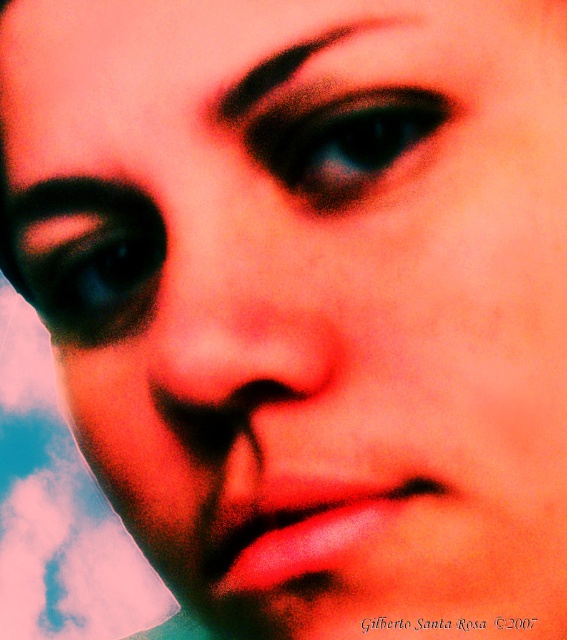
Based on the photo, who is taller, matte black eye at upper left or black matte eyebrow at upper center?

matte black eye at upper left

Between matte black eye at upper left and black matte eyebrow at upper center, which one is positioned higher?

black matte eyebrow at upper center

Is point (122, 280) closer to viewer compared to point (243, 100)?

No, (122, 280) is further to viewer.

At what (x,y) coordinates should I click in order to perform the action: click on matte black eye at upper left. Please return your answer as a coordinate pair (x, y). This screenshot has height=640, width=567. Looking at the image, I should click on (94, 268).

Which is behind, point (391, 120) or point (236, 106)?

The point (236, 106) is more distant.

How distant is black glittery eye at center from black matte eyebrow at upper center?

They are 0.42 inches apart.

Locate an element on the screen. This screenshot has width=567, height=640. black glittery eye at center is located at coordinates (341, 138).

Between point (367, 161) and point (162, 252), which one is positioned in front?

Point (367, 161) is more forward.

The image size is (567, 640). What do you see at coordinates (341, 138) in the screenshot? I see `black glittery eye at center` at bounding box center [341, 138].

Between point (311, 125) and point (69, 268), which one is positioned behind?

The point (69, 268) is behind.

The height and width of the screenshot is (640, 567). In order to click on black glittery eye at center in this screenshot , I will do (341, 138).